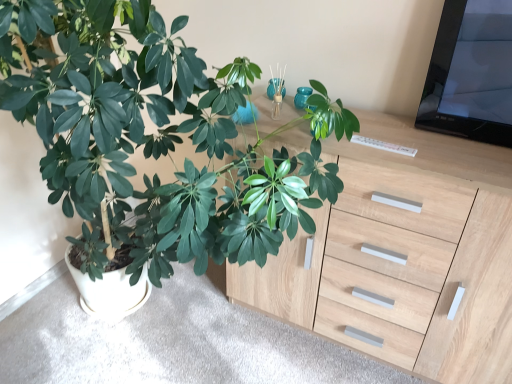
I want to click on vacant space underneath green matte plant at left (from a real-world perspective), so click(x=135, y=346).